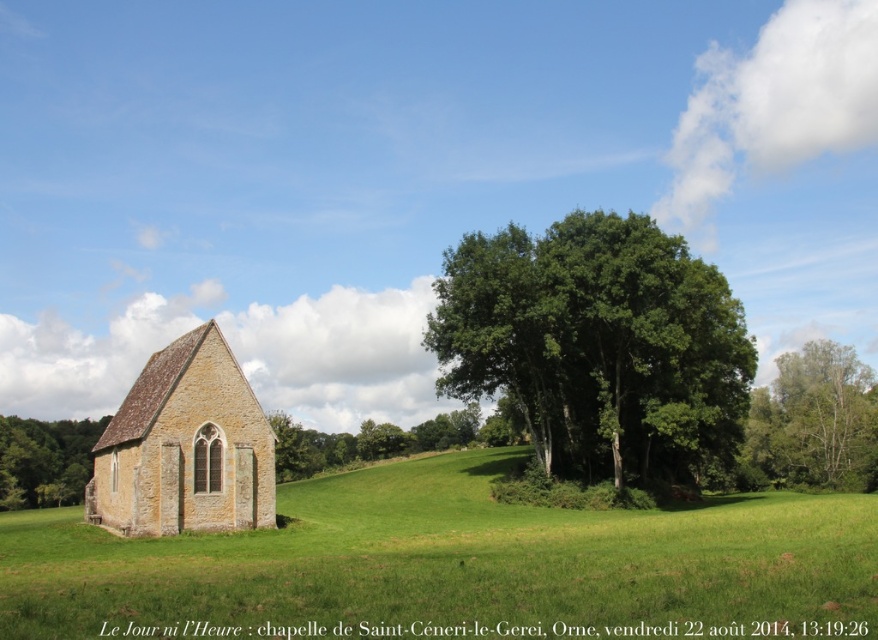
You are an artist planning to paint the rural landscape scene. You have to decide which area to focus on first between the green grassy field at lower left and the green leafy tree at lower left. Which one should you paint first if you want to start with the larger object?

The green grassy field at lower left is bigger than the green leafy tree at lower left, so you should paint the green grassy field at lower left first.

You are a drone operator who needs to fly a drone from the chapel to the green leafy tree at center. The drone has a maximum range of 80 meters. Can you safely reach the tree without exceeding the drone range?

The distance between the chapel and the green leafy tree at center is 82.13 meters, which exceeds the drone range of 80 meters. Therefore, the drone cannot safely reach the tree without exceeding its maximum range.

You are standing at the base of the green leafy tree at lower left and want to walk to the chapel. Which direction should you head to avoid the green grassy field at lower left?

The green grassy field at lower left is taller than the green leafy tree at lower left, so to avoid it, you should head towards the right or away from the green grassy field at lower left.